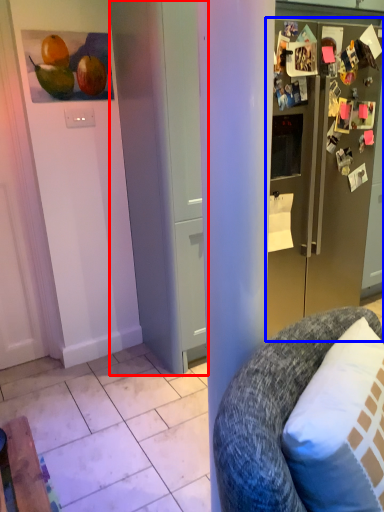
Question: Which object appears farthest to the camera in this image, door (highlighted by a red box) or refrigerator (highlighted by a blue box)?

Choices:
 (A) door
 (B) refrigerator

Answer: (B)